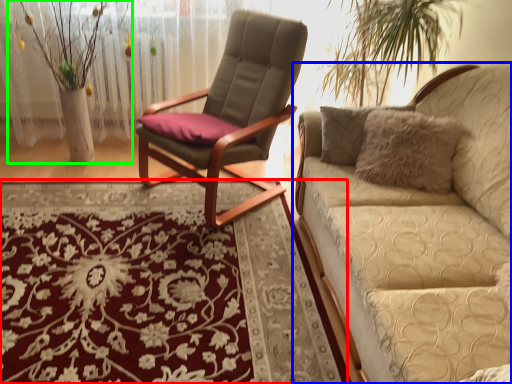
Question: Estimate the real-world distances between objects in this image. Which object is farther from mat (highlighted by a red box), studio couch (highlighted by a blue box) or floral arrangement (highlighted by a green box)?

Choices:
 (A) studio couch
 (B) floral arrangement

Answer: (B)